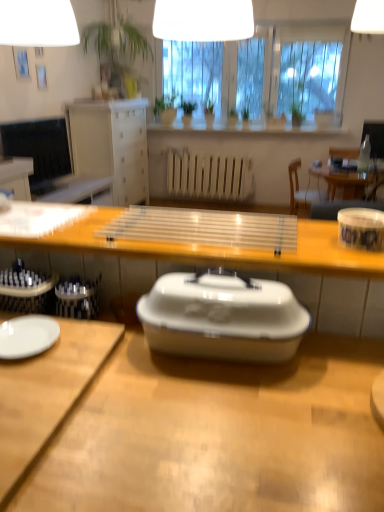
Image resolution: width=384 pixels, height=512 pixels. In order to click on white glossy mug at right in this screenshot , I will do `click(361, 228)`.

Image resolution: width=384 pixels, height=512 pixels. Describe the element at coordinates (304, 64) in the screenshot. I see `transparent glass window at upper center` at that location.

This screenshot has width=384, height=512. I want to click on white plastic chair at right, so click(301, 193).

Locate an element on the screen. green leafy plant at upper left, which appears as the 1th houseplant when viewed from the left is located at coordinates (117, 45).

At what (x,y) coordinates should I click in order to perform the action: click on green leafy plant at center, which ranks as the 5th houseplant in left-to-right order. Please return your answer as a coordinate pair (x, y). Looking at the image, I should click on (232, 118).

The image size is (384, 512). What are the coordinates of `desk that is the 2nd object to the right of the white glossy trash bin/can at lower left, the first trash bin/can when ordered from left to right, starting at the anchor` in the screenshot? It's located at (219, 434).

Is white glossy plastic container at center, positioned as the 1th desk in bottom-to-top order, to the left or to the right of white glossy trash bin/can at lower left, the first trash bin/can when ordered from left to right, in the image?

white glossy plastic container at center, positioned as the 1th desk in bottom-to-top order, is to the right of white glossy trash bin/can at lower left, the first trash bin/can when ordered from left to right.

How far apart are white glossy plastic container at center, the 3th desk in the top-to-bottom sequence, and white glossy trash bin/can at lower left, the first trash bin/can when ordered from left to right?

The distance of white glossy plastic container at center, the 3th desk in the top-to-bottom sequence, from white glossy trash bin/can at lower left, the first trash bin/can when ordered from left to right, is 19.51 inches.

Which of these two, white glossy plastic container at center, positioned as the 1th desk in bottom-to-top order, or white glossy trash bin/can at lower left, the second trash bin/can from the right, is smaller?

With smaller size is white glossy trash bin/can at lower left, the second trash bin/can from the right.

Which object is positioned more to the right, white glossy trash bin/can at lower left, the second trash bin/can from the right, or green leafy plant at center, which is the second houseplant from right to left?

green leafy plant at center, which is the second houseplant from right to left.

Consider the image. Is white glossy trash bin/can at lower left, the second trash bin/can from the right, smaller than green leafy plant at center, positioned as the fourth houseplant in left-to-right order?

Yes, white glossy trash bin/can at lower left, the second trash bin/can from the right, is smaller than green leafy plant at center, positioned as the fourth houseplant in left-to-right order.

Could you tell me if white glossy trash bin/can at lower left, the first trash bin/can when ordered from left to right, is turned towards green leafy plant at center, which is the second houseplant from right to left?

No, white glossy trash bin/can at lower left, the first trash bin/can when ordered from left to right, is not facing towards green leafy plant at center, which is the second houseplant from right to left.

Choose the correct answer: Is white plastic chair at right inside white glossy lampshade at upper center or outside it?

white plastic chair at right is not enclosed by white glossy lampshade at upper center.

Considering the sizes of white plastic chair at right and white glossy lampshade at upper center in the image, is white plastic chair at right taller or shorter than white glossy lampshade at upper center?

In the image, white plastic chair at right appears to be taller than white glossy lampshade at upper center.

Find the location of a particular element. lamp that appears on the left of white plastic chair at right is located at coordinates (203, 20).

Is green leafy plant at center, arranged as the 1th houseplant when viewed from the right, spatially inside white glossy sink at center, or outside of it?

green leafy plant at center, arranged as the 1th houseplant when viewed from the right, cannot be found inside white glossy sink at center.

Which object is positioned more to the left, green leafy plant at center, arranged as the 1th houseplant when viewed from the right, or white glossy sink at center?

white glossy sink at center is more to the left.

Can you confirm if green leafy plant at center, arranged as the 1th houseplant when viewed from the right, is shorter than white glossy sink at center?

Incorrect, the height of green leafy plant at center, arranged as the 1th houseplant when viewed from the right, does not fall short of that of white glossy sink at center.

Measure the distance from white glossy trash bin/can at lower left, the second trash bin/can from the right, to green leafy plant at upper center.

white glossy trash bin/can at lower left, the second trash bin/can from the right, is 4.95 meters away from green leafy plant at upper center.

Are white glossy trash bin/can at lower left, the first trash bin/can when ordered from left to right, and green leafy plant at upper center far apart?

That's right, there is a large distance between white glossy trash bin/can at lower left, the first trash bin/can when ordered from left to right, and green leafy plant at upper center.

Who is shorter, white glossy trash bin/can at lower left, the first trash bin/can when ordered from left to right, or green leafy plant at upper center?

white glossy trash bin/can at lower left, the first trash bin/can when ordered from left to right.

Between wooden desk at lower left, the second desk ordered from the bottom, and white glossy plastic container at center, positioned as the 1th desk in bottom-to-top order, which one has smaller size?

With smaller size is wooden desk at lower left, the second desk ordered from the bottom.

Can you see wooden desk at lower left, which is the second desk in top-to-bottom order, touching white glossy plastic container at center, the 3th desk in the top-to-bottom sequence?

No, wooden desk at lower left, which is the second desk in top-to-bottom order, is not making contact with white glossy plastic container at center, the 3th desk in the top-to-bottom sequence.

Can you tell me how much wooden desk at lower left, which is the second desk in top-to-bottom order, and white glossy plastic container at center, positioned as the 1th desk in bottom-to-top order, differ in facing direction?

They differ by 0.000349 degrees in their facing directions.

Is wooden desk at lower left, the second desk ordered from the bottom, facing away from white glossy plastic container at center, positioned as the 1th desk in bottom-to-top order?

Yes.

Would you say white glossy mug at right is a long distance from green matte plant at center, acting as the 2th houseplant starting from the left?

Absolutely, white glossy mug at right is distant from green matte plant at center, acting as the 2th houseplant starting from the left.

Is point (350, 245) positioned after point (170, 119)?

No, it is in front of (170, 119).

Where is `houseplant that is the 3rd one when counting backward from the white glossy mug at right`? houseplant that is the 3rd one when counting backward from the white glossy mug at right is located at coordinates point(165,109).

From a real-world perspective, between white glossy mug at right and green matte plant at center, acting as the 2th houseplant starting from the left, who is vertically lower?

white glossy mug at right, from a real-world perspective.

From the image's perspective, which trash bin/can is the 2nd one above the white glossy plastic container at center, the 3th desk in the top-to-bottom sequence? Please provide its 2D coordinates.

[(27, 291)]

There is a green leafy plant at center, positioned as the fourth houseplant in left-to-right order. Where is `the 1st trash bin/can below it (from the image's perspective)`? the 1st trash bin/can below it (from the image's perspective) is located at coordinates (27, 291).

When comparing their distances from white glossy mug at right, does white glossy plastic container at center, the 3th desk in the top-to-bottom sequence, or green leafy plant at upper center seem further?

green leafy plant at upper center is further to white glossy mug at right.

Which object lies further to the anchor point green leafy plant at upper center, green leafy plant at upper left, which is counted as the fifth houseplant, starting from the right, or white glossy lampshade at upper center?

white glossy lampshade at upper center lies further to green leafy plant at upper center than the other object.

Looking at the image, which one is located closer to white glossy trash bin/can at lower left, the second trash bin/can from the right, black glossy television at upper left or white glossy sink at center?

white glossy sink at center lies closer to white glossy trash bin/can at lower left, the second trash bin/can from the right, than the other object.

Considering their positions, is white matte radiator at center positioned further to black glossy television at upper left than white glossy plate at lower left?

Based on the image, white glossy plate at lower left appears to be further to black glossy television at upper left.

Considering their positions, is transparent glass window at upper center positioned further to green glossy houseplant at center, the third houseplant viewed from the left, than matte white vase at upper center?

The object further to green glossy houseplant at center, the third houseplant viewed from the left, is transparent glass window at upper center.

Based on their spatial positions, is white matte radiator at center or white glossy trash bin/can at lower left, the first trash bin/can when ordered from left to right, further from green leafy plant at upper left, which appears as the 1th houseplant when viewed from the left?

white glossy trash bin/can at lower left, the first trash bin/can when ordered from left to right, lies further to green leafy plant at upper left, which appears as the 1th houseplant when viewed from the left, than the other object.

From the image, which object appears to be nearer to transparent plastic tray at center, placed as the 3th desk when sorted from bottom to top, green leafy plant at upper left, which appears as the 1th houseplant when viewed from the left, or green matte plant at center, acting as the 2th houseplant starting from the left?

green leafy plant at upper left, which appears as the 1th houseplant when viewed from the left, lies closer to transparent plastic tray at center, placed as the 3th desk when sorted from bottom to top, than the other object.

From the image, which object appears to be nearer to white glossy plate at lower left, white glossy lampshade at upper center or green glossy houseplant at center, the third houseplant viewed from the left?

Based on the image, white glossy lampshade at upper center appears to be nearer to white glossy plate at lower left.

The width and height of the screenshot is (384, 512). I want to click on television between white glossy plate at lower left and white plastic chair at right in the front-back direction, so click(x=39, y=147).

The image size is (384, 512). Find the location of `window between wooden desk at lower left, which is the second desk in top-to-bottom order, and matte white vase at upper center, along the z-axis`. window between wooden desk at lower left, which is the second desk in top-to-bottom order, and matte white vase at upper center, along the z-axis is located at coordinates (304, 64).

What are the coordinates of `lamp between black glossy television at upper left and green leafy plant at upper center in the horizontal direction` in the screenshot? It's located at (203, 20).

I want to click on lamp between white glossy mug at right and green leafy plant at center, positioned as the fourth houseplant in left-to-right order, in the front-back direction, so click(x=203, y=20).